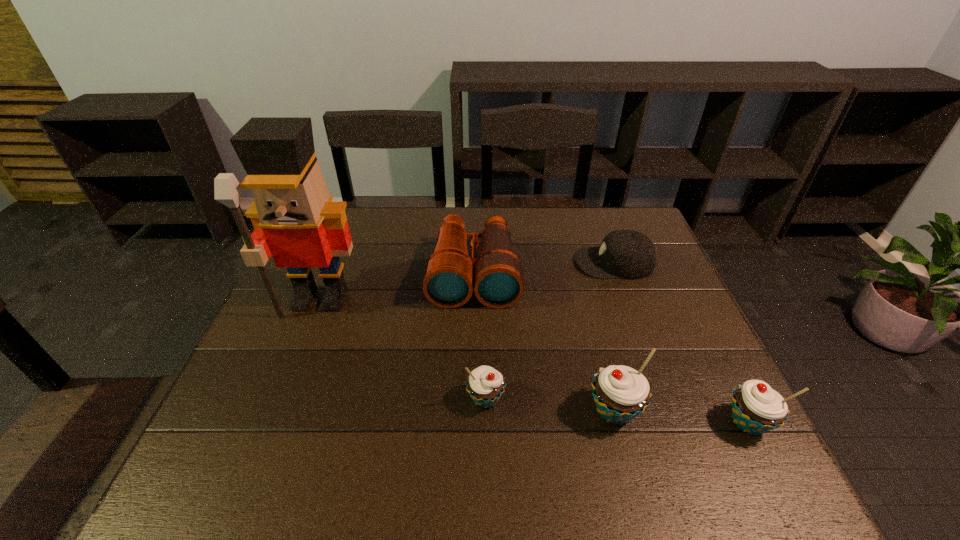
The height and width of the screenshot is (540, 960). I want to click on the leftmost cupcake, so click(x=485, y=385).

Image resolution: width=960 pixels, height=540 pixels. I want to click on the second cupcake from right to left, so click(621, 393).

You are a GUI agent. You are given a task and a screenshot of the screen. Output one action in this format:
    pyautogui.click(x=<x>, y=<y>)
    Task: Click on the second tallest cupcake
    This screenshot has height=540, width=960.
    Given the screenshot: What is the action you would take?
    pyautogui.click(x=756, y=408)

You are a GUI agent. You are given a task and a screenshot of the screen. Output one action in this format:
    pyautogui.click(x=<x>, y=<y>)
    Task: Click on the cap
    
    Given the screenshot: What is the action you would take?
    pyautogui.click(x=630, y=254)

The height and width of the screenshot is (540, 960). In order to click on binoculars in this screenshot , I will do click(448, 279).

Where is `the leftmost object`? Image resolution: width=960 pixels, height=540 pixels. the leftmost object is located at coordinates (294, 219).

Identify the location of the tallest object. The image size is (960, 540). (294, 219).

Find the location of `vacant space situated 0.250m on the back of the leftmost cupcake`. vacant space situated 0.250m on the back of the leftmost cupcake is located at coordinates (485, 306).

Locate an element on the screen. vacant space located on the back of the second cupcake from right to left is located at coordinates (583, 292).

I want to click on vacant point located on the back of the second tallest cupcake, so click(679, 286).